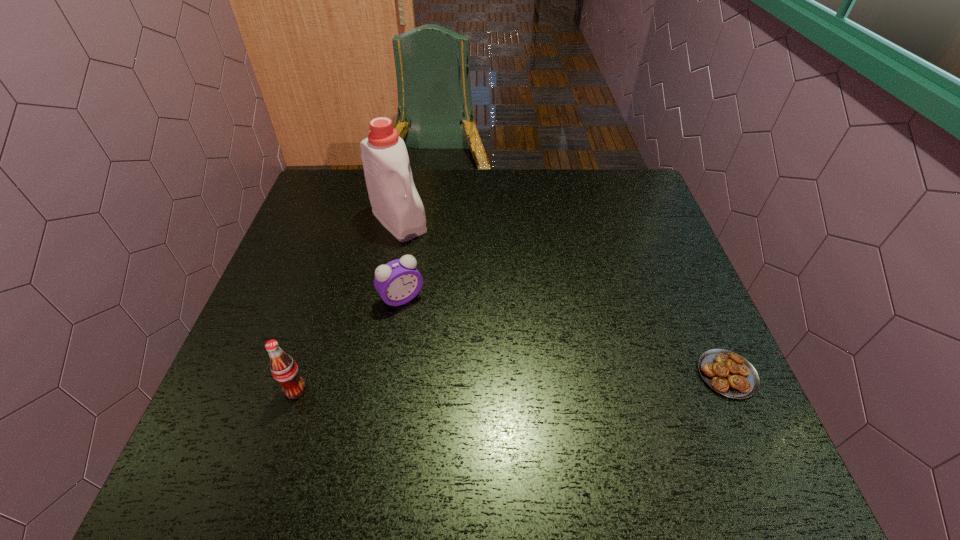
This screenshot has height=540, width=960. Find the location of `free space located on the handle side of the detergent`. free space located on the handle side of the detergent is located at coordinates (463, 291).

Locate an element on the screen. The image size is (960, 540). vacant space located 0.210m on the handle side of the detergent is located at coordinates (456, 284).

You are a GUI agent. You are given a task and a screenshot of the screen. Output one action in this format:
    pyautogui.click(x=<x>, y=<y>)
    Task: Click on the vacant space located 0.320m on the handle side of the detergent
    Image resolution: width=960 pixels, height=540 pixels.
    Given the screenshot: What is the action you would take?
    pyautogui.click(x=482, y=312)

You are a GUI agent. You are given a task and a screenshot of the screen. Output one action in this format:
    pyautogui.click(x=<x>, y=<y>)
    Task: Click on the free space located 0.270m on the face of the alarm clock
    This screenshot has height=540, width=960.
    Given the screenshot: What is the action you would take?
    pyautogui.click(x=474, y=398)

I want to click on vacant space situated on the face of the alarm clock, so click(433, 339).

Locate an element on the screen. This screenshot has width=960, height=540. vacant space located 0.210m on the face of the alarm clock is located at coordinates (459, 376).

The width and height of the screenshot is (960, 540). What are the coordinates of `object that is at the far edge` in the screenshot? It's located at (395, 202).

You are a GUI agent. You are given a task and a screenshot of the screen. Output one action in this format:
    pyautogui.click(x=<x>, y=<y>)
    Task: Click on the soda situated at the near edge
    
    Given the screenshot: What is the action you would take?
    pyautogui.click(x=284, y=369)

You are a GUI agent. You are given a task and a screenshot of the screen. Output one action in this format:
    pyautogui.click(x=<x>, y=<y>)
    Task: Click on the pastry present at the near edge
    
    Given the screenshot: What is the action you would take?
    pyautogui.click(x=728, y=373)

Where is `object that is at the left edge`? The image size is (960, 540). object that is at the left edge is located at coordinates pos(284,369).